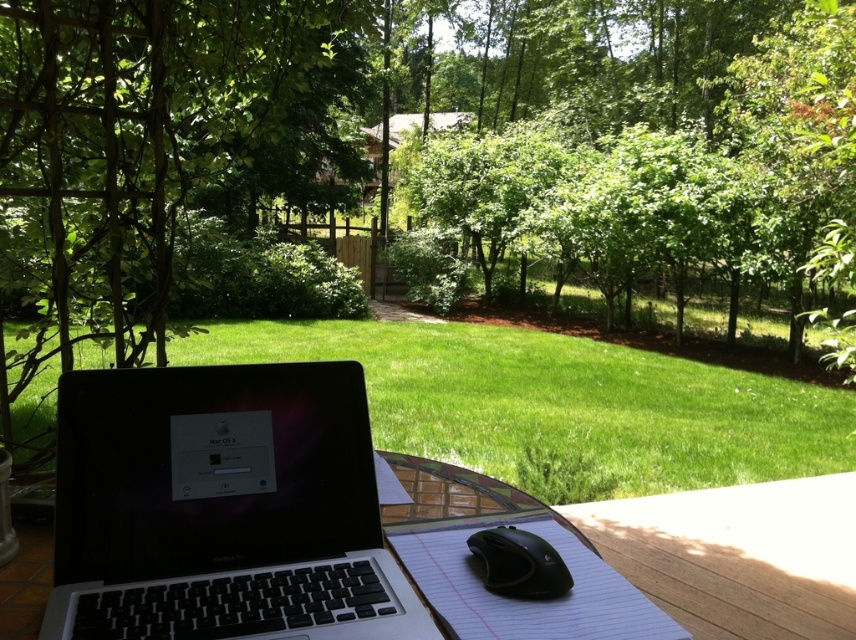
Question: Which point appears closest to the camera in this image?

Choices:
 (A) (568, 634)
 (B) (152, 419)
 (C) (496, 548)
 (D) (694, 1)

Answer: (A)

Question: Considering the real-world distances, which object is farthest from the green leafy tree at upper center?

Choices:
 (A) black rubberized mouse at lower center
 (B) white lined notebook at center

Answer: (A)

Question: Is green leafy tree at upper center further to the viewer compared to sleek black laptop at lower left?

Choices:
 (A) no
 (B) yes

Answer: (B)

Question: Among these objects, which one is nearest to the camera?

Choices:
 (A) metallic silver picnic table at center
 (B) sleek black laptop at lower left

Answer: (B)

Question: Does green leafy tree at upper center appear over black rubberized mouse at lower center?

Choices:
 (A) no
 (B) yes

Answer: (B)

Question: Can you confirm if sleek black laptop at lower left is smaller than metallic silver picnic table at center?

Choices:
 (A) no
 (B) yes

Answer: (B)